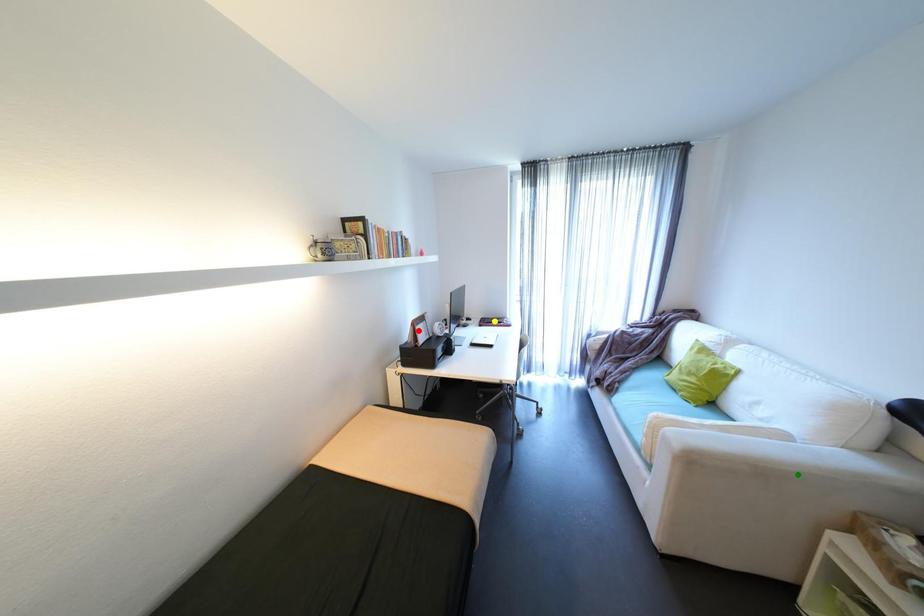
Order these from nearest to farthest:
A) red point
B) green point
C) yellow point

green point, red point, yellow point